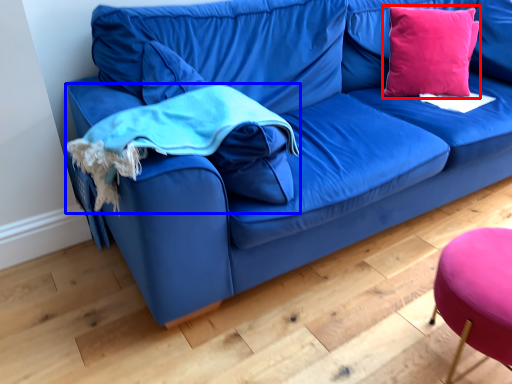
Question: Which point is further to the camera, throw pillow (highlighted by a red box) or cloth (highlighted by a blue box)?

Choices:
 (A) throw pillow
 (B) cloth

Answer: (A)